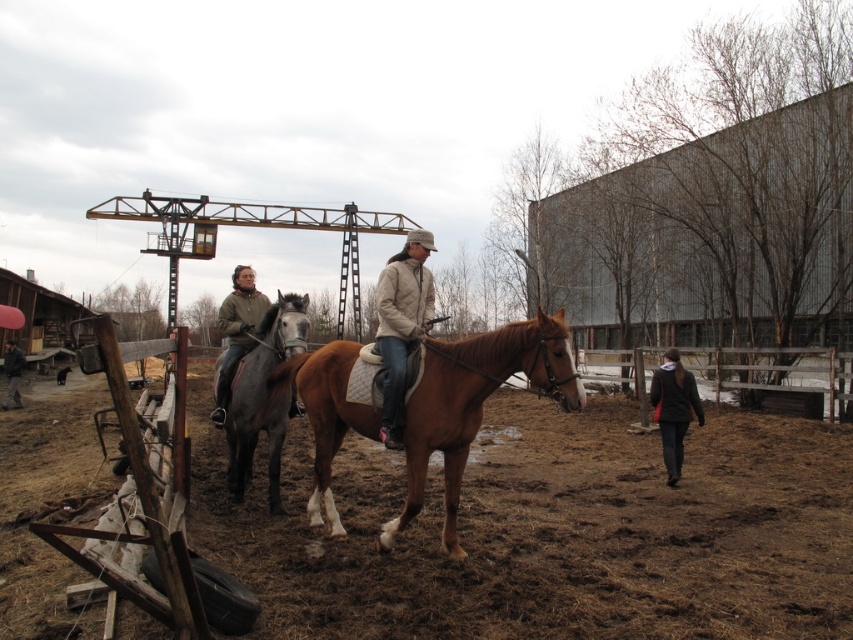
From the picture: Does beige quilted jacket at center have a lesser width compared to dark gray jacket at lower right?

Indeed, beige quilted jacket at center has a lesser width compared to dark gray jacket at lower right.

Is beige quilted jacket at center to the right of dark gray jacket at lower right from the viewer's perspective?

No, beige quilted jacket at center is not to the right of dark gray jacket at lower right.

Describe the element at coordinates (401, 324) in the screenshot. I see `beige quilted jacket at center` at that location.

Image resolution: width=853 pixels, height=640 pixels. Identify the location of beige quilted jacket at center. (401, 324).

Is gray glossy horse at left wider than dark brown leather jacket at lower left?

Incorrect, gray glossy horse at left's width does not surpass dark brown leather jacket at lower left's.

Does point (267, 374) come closer to viewer compared to point (10, 362)?

Yes, point (267, 374) is closer to viewer.

Who is more forward, [260,422] or [9,380]?

Point [260,422] is more forward.

Where is `gray glossy horse at left`? gray glossy horse at left is located at coordinates (262, 396).

Which is below, brown glossy horse at center or beige quilted jacket at center?

Positioned lower is brown glossy horse at center.

Based on the photo, does brown glossy horse at center appear on the right side of beige quilted jacket at center?

Yes, brown glossy horse at center is to the right of beige quilted jacket at center.

Where is `brown glossy horse at center`? This screenshot has width=853, height=640. brown glossy horse at center is located at coordinates (474, 404).